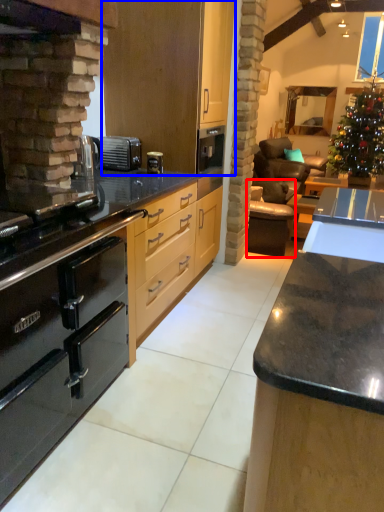
Question: Which object is further to the camera taking this photo, armchair (highlighted by a red box) or cabinetry (highlighted by a blue box)?

Choices:
 (A) armchair
 (B) cabinetry

Answer: (A)